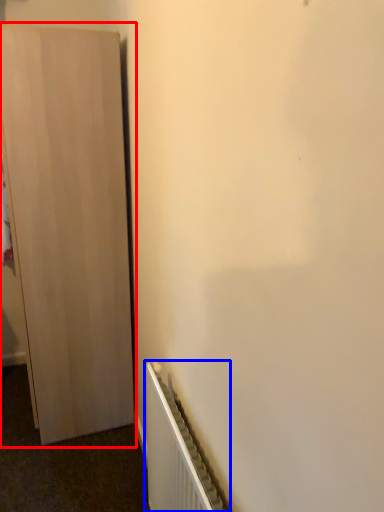
Question: Which object appears farthest to the camera in this image, cupboard (highlighted by a red box) or radiator (highlighted by a blue box)?

Choices:
 (A) cupboard
 (B) radiator

Answer: (A)